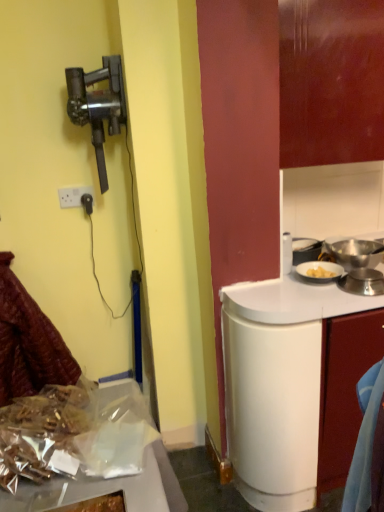
The width and height of the screenshot is (384, 512). I want to click on white plastic power outlet at upper left, so click(x=73, y=196).

Where is `shiny metallic foil at lower left`? The width and height of the screenshot is (384, 512). shiny metallic foil at lower left is located at coordinates (92, 490).

The height and width of the screenshot is (512, 384). Identify the location of white glossy cabinet at right. (344, 389).

What do you see at coordinates (344, 389) in the screenshot?
I see `white glossy cabinet at right` at bounding box center [344, 389].

Identify the location of white plastic power outlet at upper left. (73, 196).

Considering the sizes of objects leather-like maroon coat at lower left and shiny metallic foil at lower left in the image provided, who is shorter, leather-like maroon coat at lower left or shiny metallic foil at lower left?

With less height is shiny metallic foil at lower left.

Which is more to the left, leather-like maroon coat at lower left or shiny metallic foil at lower left?

leather-like maroon coat at lower left is more to the left.

Is leather-like maroon coat at lower left not near shiny metallic foil at lower left?

leather-like maroon coat at lower left is far away from shiny metallic foil at lower left.

Is shiny metallic foil at lower left thinner than white glossy cabinet at right?

No.

Considering the sizes of objects shiny metallic foil at lower left and white glossy cabinet at right in the image provided, who is smaller, shiny metallic foil at lower left or white glossy cabinet at right?

shiny metallic foil at lower left is smaller.

Is shiny metallic foil at lower left shorter than white glossy cabinet at right?

Correct, shiny metallic foil at lower left is not as tall as white glossy cabinet at right.

Does white plastic power outlet at upper left touch metallic black vacuum cleaner at left?

No, white plastic power outlet at upper left is not with metallic black vacuum cleaner at left.

Considering the relative sizes of white plastic power outlet at upper left and metallic black vacuum cleaner at left in the image provided, is white plastic power outlet at upper left thinner than metallic black vacuum cleaner at left?

Yes.

Between white plastic power outlet at upper left and metallic black vacuum cleaner at left, which one appears on the left side from the viewer's perspective?

white plastic power outlet at upper left is more to the left.

How many degrees apart are the facing directions of white plastic power outlet at upper left and metallic black vacuum cleaner at left?

The angular difference between white plastic power outlet at upper left and metallic black vacuum cleaner at left is 87.7 degrees.

Is white plastic power outlet at upper left turned away from shiny metallic foil at lower left?

white plastic power outlet at upper left is not turned away from shiny metallic foil at lower left.

This screenshot has height=512, width=384. Identify the location of kitchen appliance located below the white plastic power outlet at upper left (from the image's perspective). (92, 490).

Who is bigger, white plastic power outlet at upper left or shiny metallic foil at lower left?

shiny metallic foil at lower left is bigger.

How much distance is there between shiny metallic foil at lower left and white plastic power outlet at upper left?

A distance of 1.25 meters exists between shiny metallic foil at lower left and white plastic power outlet at upper left.

Is the surface of shiny metallic foil at lower left in direct contact with white plastic power outlet at upper left?

They are not placed beside each other.

Is shiny metallic foil at lower left completely or partially outside of white plastic power outlet at upper left?

Yes, shiny metallic foil at lower left is not within white plastic power outlet at upper left.

Which object is wider, shiny metallic foil at lower left or white plastic power outlet at upper left?

Wider between the two is shiny metallic foil at lower left.

Does leather-like maroon coat at lower left have a greater height compared to white glossy cabinet at right?

Indeed, leather-like maroon coat at lower left has a greater height compared to white glossy cabinet at right.

Who is smaller, leather-like maroon coat at lower left or white glossy cabinet at right?

Smaller between the two is white glossy cabinet at right.

From the picture: Is white glossy cabinet at right completely or partially inside leather-like maroon coat at lower left?

No, white glossy cabinet at right is not surrounded by leather-like maroon coat at lower left.

Considering the relative sizes of leather-like maroon coat at lower left and white glossy cabinet at right in the image provided, is leather-like maroon coat at lower left thinner than white glossy cabinet at right?

In fact, leather-like maroon coat at lower left might be wider than white glossy cabinet at right.

Is white glossy cabinet at right taller or shorter than white plastic power outlet at upper left?

In the image, white glossy cabinet at right appears to be taller than white plastic power outlet at upper left.

Does point (320, 460) appear closer or farther from the camera than point (78, 188)?

Clearly, point (320, 460) is closer to the camera than point (78, 188).

From the image's perspective, is white glossy cabinet at right beneath white plastic power outlet at upper left?

Indeed, from the image's perspective, white glossy cabinet at right is shown beneath white plastic power outlet at upper left.

Visually, is white glossy cabinet at right positioned to the left or to the right of white plastic power outlet at upper left?

white glossy cabinet at right is positioned on white plastic power outlet at upper left's right side.

Where is `kitchen appliance in front of the leather-like maroon coat at lower left`? The height and width of the screenshot is (512, 384). kitchen appliance in front of the leather-like maroon coat at lower left is located at coordinates (92, 490).

Where is `kitchen appliance on the left of white glossy cabinet at right`? This screenshot has width=384, height=512. kitchen appliance on the left of white glossy cabinet at right is located at coordinates (92, 490).

Based on their spatial positions, is leather-like maroon coat at lower left or shiny metallic foil at lower left further from metallic black vacuum cleaner at left?

The object further to metallic black vacuum cleaner at left is shiny metallic foil at lower left.

Consider the image. From the image, which object appears to be farther from leather-like maroon coat at lower left, metallic black vacuum cleaner at left or white glossy cabinet at right?

white glossy cabinet at right lies further to leather-like maroon coat at lower left than the other object.

When comparing their distances from white glossy cabinet at right, does metallic black vacuum cleaner at left or leather-like maroon coat at lower left seem closer?

Among the two, leather-like maroon coat at lower left is located nearer to white glossy cabinet at right.

Based on their spatial positions, is shiny metallic foil at lower left or white plastic power outlet at upper left closer to leather-like maroon coat at lower left?

white plastic power outlet at upper left lies closer to leather-like maroon coat at lower left than the other object.

Which object lies further to the anchor point white plastic power outlet at upper left, metallic black vacuum cleaner at left or white glossy cabinet at right?

white glossy cabinet at right is further to white plastic power outlet at upper left.

Based on their spatial positions, is metallic black vacuum cleaner at left or white plastic power outlet at upper left further from leather-like maroon coat at lower left?

metallic black vacuum cleaner at left lies further to leather-like maroon coat at lower left than the other object.

Looking at the image, which one is located closer to leather-like maroon coat at lower left, white glossy cabinet at right or white plastic power outlet at upper left?

Based on the image, white plastic power outlet at upper left appears to be nearer to leather-like maroon coat at lower left.

When comparing their distances from white glossy cabinet at right, does leather-like maroon coat at lower left or metallic black vacuum cleaner at left seem further?

metallic black vacuum cleaner at left.

Find the location of `home appliance between white glossy cabinet at right and white plastic power outlet at upper left in the front-back direction`. home appliance between white glossy cabinet at right and white plastic power outlet at upper left in the front-back direction is located at coordinates (98, 105).

At what (x,y) coordinates should I click in order to perform the action: click on laundry between shiny metallic foil at lower left and white plastic power outlet at upper left along the z-axis. Please return your answer as a coordinate pair (x, y). Looking at the image, I should click on (28, 342).

What are the coordinates of `kitchen appliance between leather-like maroon coat at lower left and white glossy cabinet at right from left to right` in the screenshot? It's located at (92, 490).

The image size is (384, 512). Identify the location of home appliance between shiny metallic foil at lower left and white plastic power outlet at upper left from front to back. (98, 105).